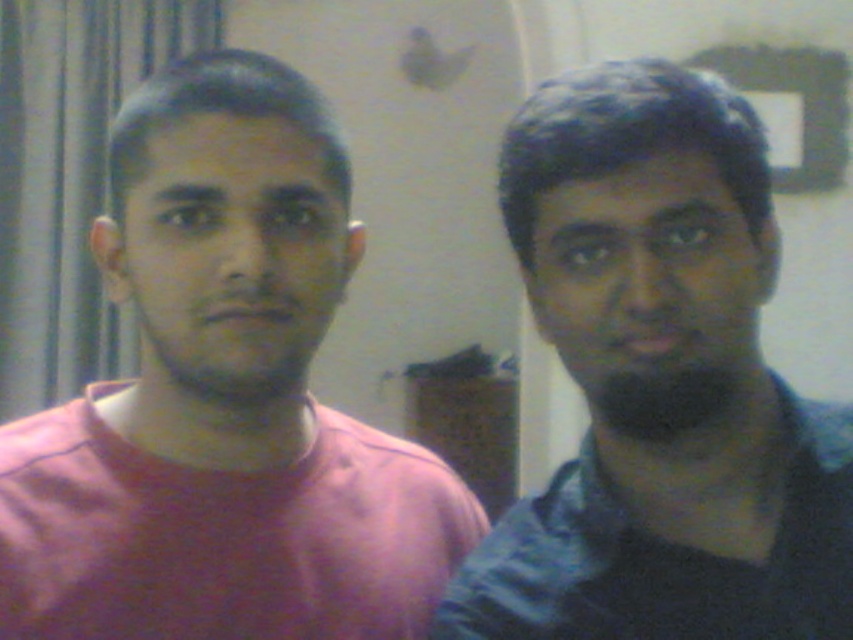
You are a photographer trying to adjust the lighting for a photo shoot. You have a spotlight that can only illuminate a circular area with a radius of 0.2 units. The center of the spotlight is currently at position point 0.5, 0.5. Will the pink matte shirt at left be fully within the illuminated area?

The pink matte shirt at left is at position point (223, 401). The distance between the spotlight center at (426, 320) and the shirt is sqrt of squared difference in x and y coordinates. Calculating sqrt of squared difference in x is 0.628 minus 0.5 equals 0.128 squared is 0.016384. Squared difference in y is 0.263 minus 0.5 equals negative 0.237 squared is 0.056169. Total squared distance is 0.016384 plus 0.056169 equals 0.072553. Square root of that is approximately 0.269. Since the radius is 0.2, the pink